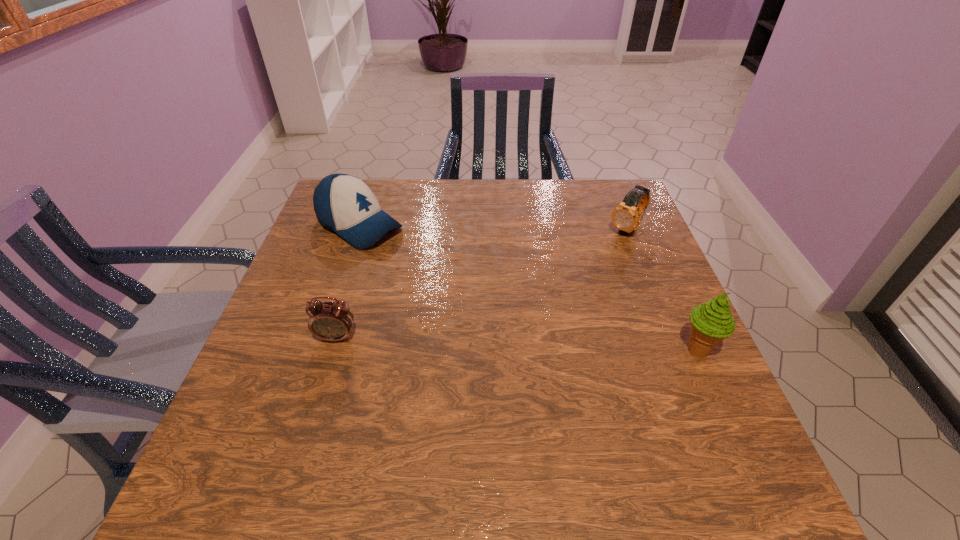
Find the location of a particular element. This screenshot has width=960, height=540. alarm clock is located at coordinates (332, 321).

Identify the location of the tallest object. This screenshot has width=960, height=540. (712, 322).

Locate an element on the screen. The height and width of the screenshot is (540, 960). baseball cap is located at coordinates (343, 203).

This screenshot has width=960, height=540. I want to click on watch, so click(x=626, y=216).

The width and height of the screenshot is (960, 540). I want to click on vacant region located on the face of the alarm clock, so click(x=317, y=402).

The image size is (960, 540). Identify the location of blank area located 0.100m on the back of the tallest object. (675, 302).

The image size is (960, 540). What are the coordinates of `free space located on the front-facing side of the baseball cap` in the screenshot? It's located at (442, 271).

Where is `vacant space located on the front-facing side of the baseball cap`? This screenshot has height=540, width=960. vacant space located on the front-facing side of the baseball cap is located at coordinates point(453,278).

At what (x,y) coordinates should I click in order to perform the action: click on free location located on the front-facing side of the baseball cap. Please return your answer as a coordinate pair (x, y). The image size is (960, 540). Looking at the image, I should click on (465, 285).

The height and width of the screenshot is (540, 960). Identify the location of vacant space situated on the face of the watch. (600, 258).